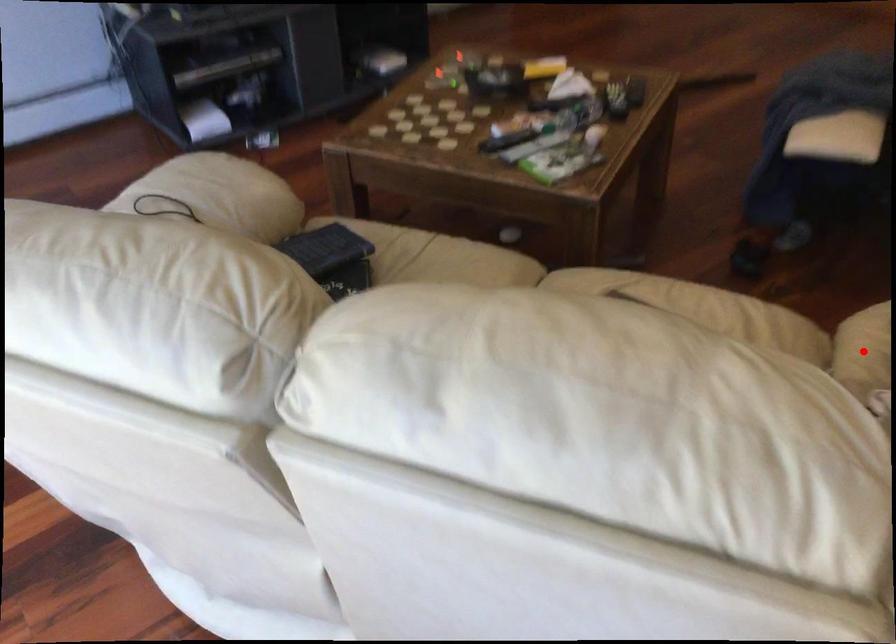
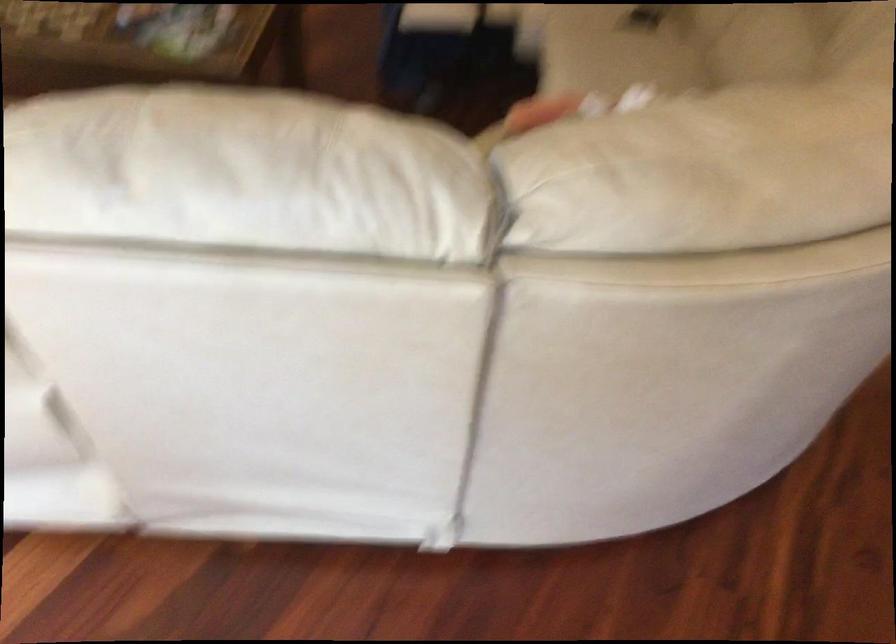
Question: I am providing you with two images of the same scene from different viewpoints. A red point is marked on the first image. Can you still see the location of the red point in image 2?

Choices:
 (A) Yes
 (B) No

Answer: (B)